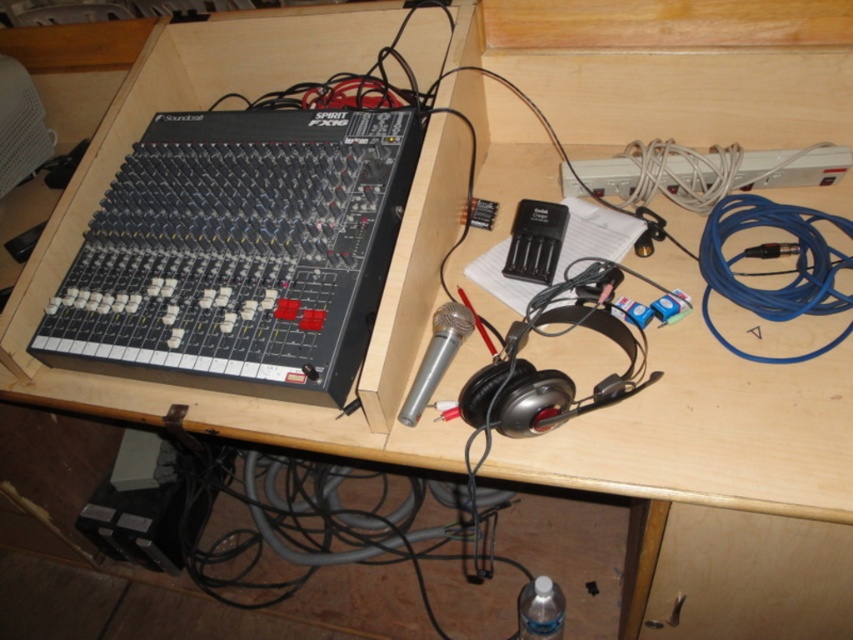
Question: From the image, what is the correct spatial relationship of blue cable at right in relation to silver metallic microphone at center?

Choices:
 (A) below
 (B) above

Answer: (B)

Question: In this image, where is wooden drawer at lower right located relative to blue cable at right?

Choices:
 (A) above
 (B) below

Answer: (B)

Question: Which of the following is the farthest from the observer?

Choices:
 (A) (466, 316)
 (B) (824, 256)
 (C) (770, 541)

Answer: (B)

Question: Estimate the real-world distances between objects in this image. Which object is closer to the blue cable at right?

Choices:
 (A) wooden drawer at lower right
 (B) silver metallic microphone at center

Answer: (B)

Question: Is wooden drawer at lower right smaller than silver metallic microphone at center?

Choices:
 (A) no
 (B) yes

Answer: (A)

Question: Which of the following is the closest to the observer?

Choices:
 (A) silver metallic microphone at center
 (B) blue cable at right

Answer: (A)